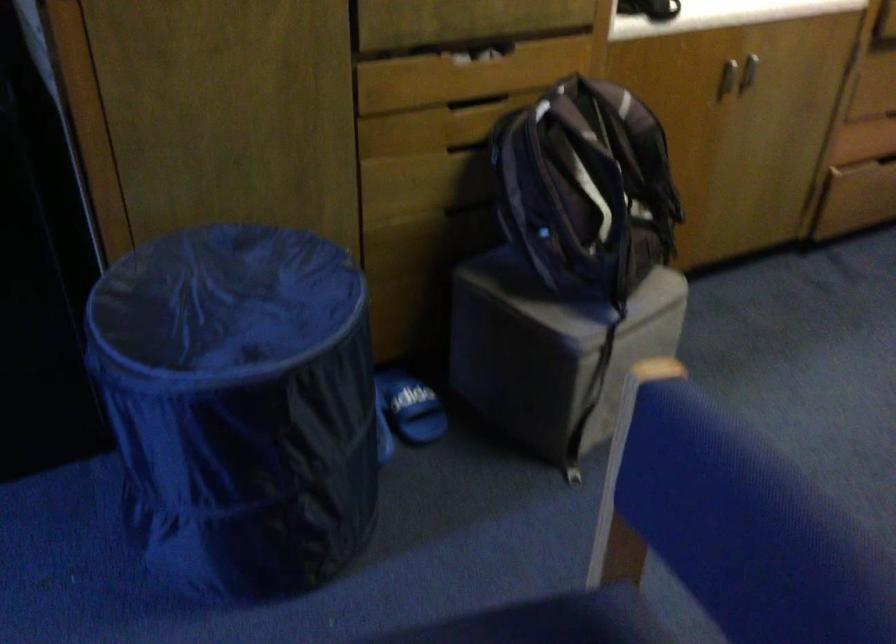
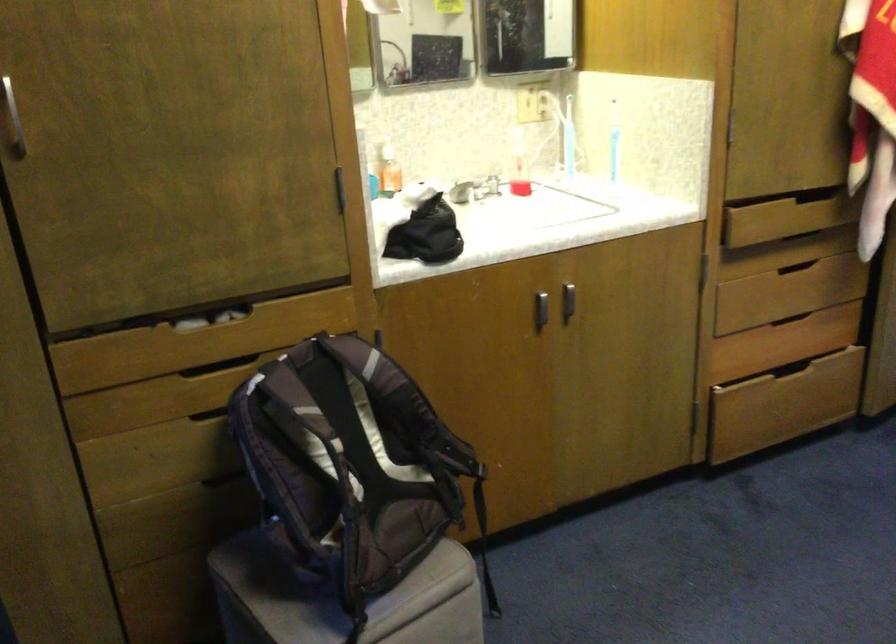
Question: How did the camera likely rotate?

Choices:
 (A) Left
 (B) Right
 (C) Up
 (D) Down

Answer: (C)